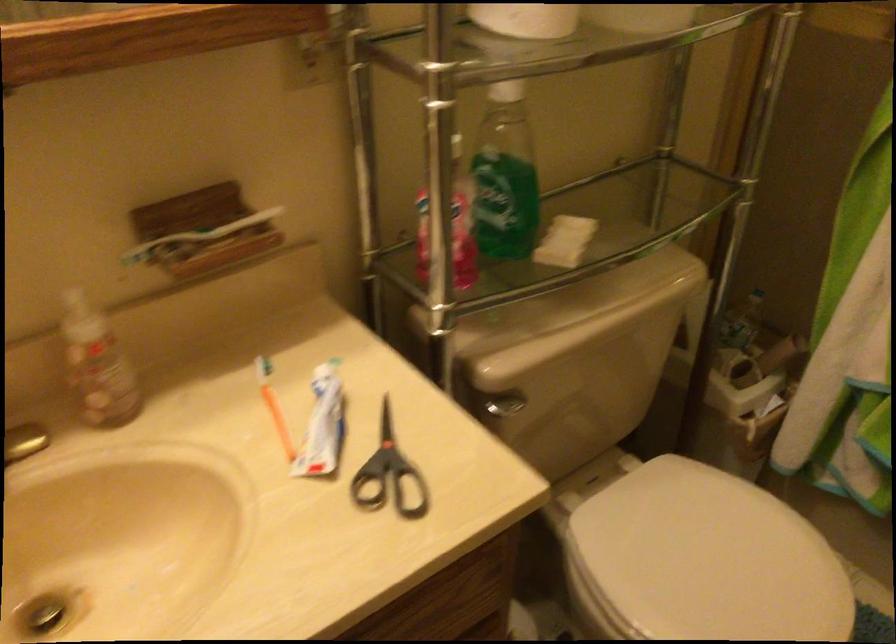
Describe the element at coordinates (504, 404) in the screenshot. I see `the toilet flush handle` at that location.